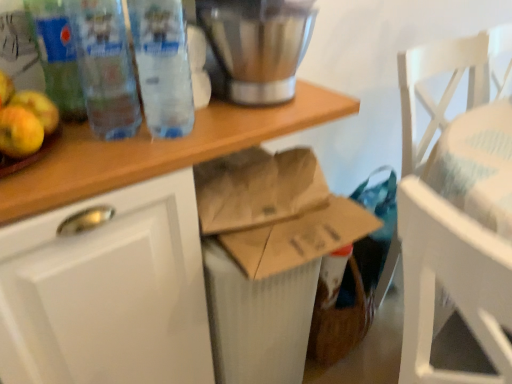
Where is `free space in front of transparent plastic bottle at upper left, the 2th bottle in the right-to-left sequence`? The image size is (512, 384). free space in front of transparent plastic bottle at upper left, the 2th bottle in the right-to-left sequence is located at coordinates (100, 163).